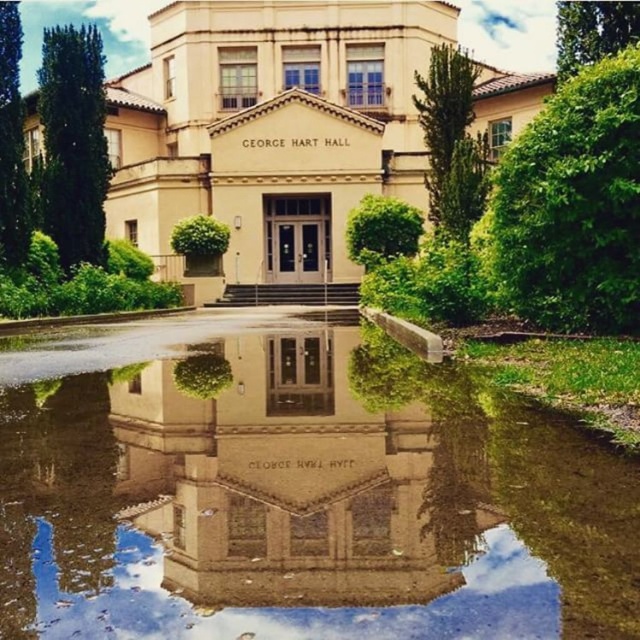
You are standing in front of George Hart Hall and want to take a photo of the beige stone building at center and its reflection in the clear glass water at center. Which object will appear smaller in the photo?

The clear glass water at center is thinner than the beige stone building at center, so the clear glass water at center will appear smaller in the photo.